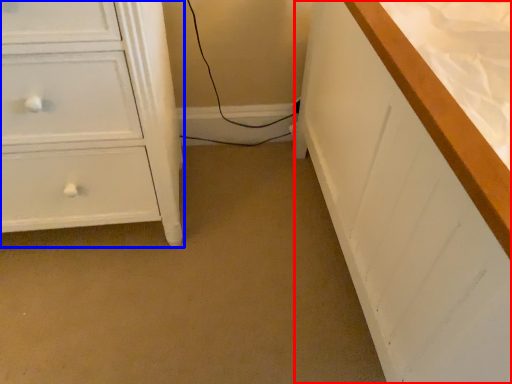
Question: Among these objects, which one is nearest to the camera, counter top (highlighted by a red box) or chest of drawers (highlighted by a blue box)?

Choices:
 (A) counter top
 (B) chest of drawers

Answer: (A)